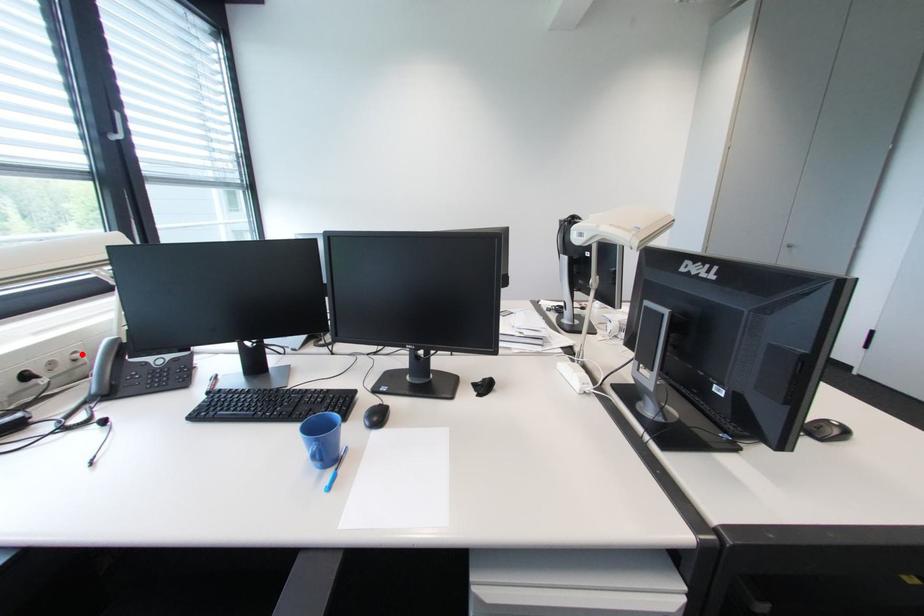
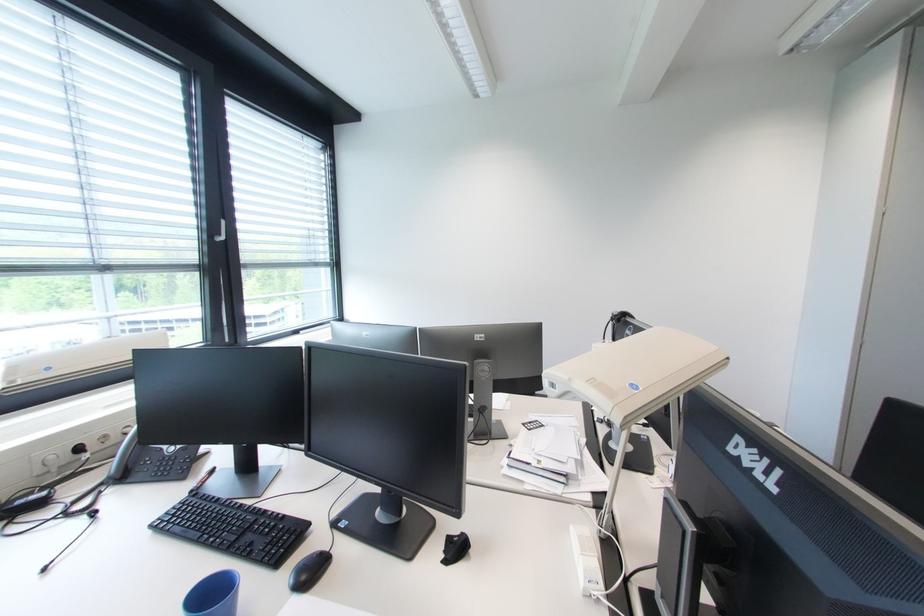
In the second image, find the point that corresponds to the highlighted location in the first image.

(134, 428)